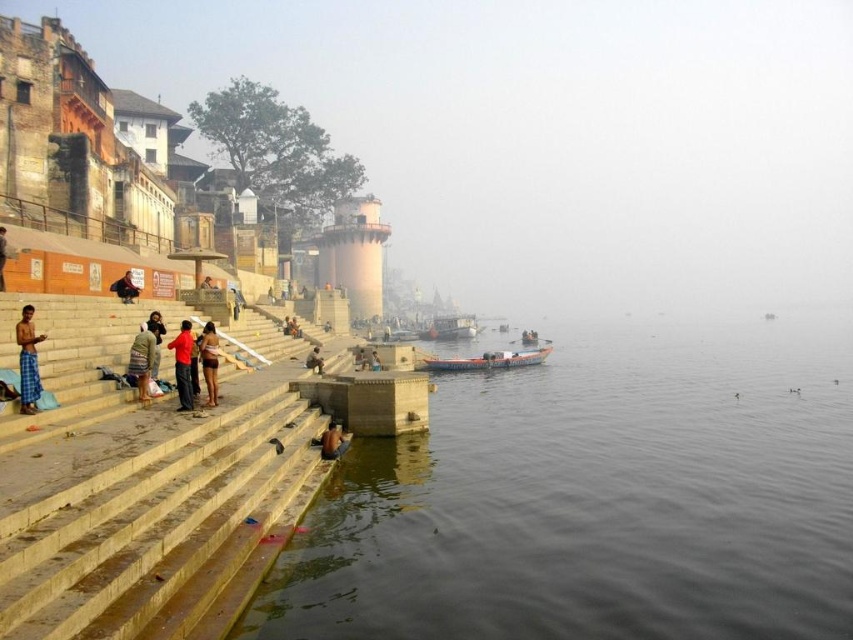
Which is in front, point (132, 292) or point (3, 262)?

Positioned in front is point (3, 262).

Is point (125, 284) less distant than point (3, 244)?

No, (125, 284) is further to viewer.

The image size is (853, 640). Find the location of `dark brown leather jacket at center`. dark brown leather jacket at center is located at coordinates (125, 289).

Find the location of `dark brown leather jacket at center`. dark brown leather jacket at center is located at coordinates (125, 289).

Is the position of dark gray water at lower center less distant than that of dark blue fabric at lower left?

Yes, dark gray water at lower center is in front of dark blue fabric at lower left.

Can you confirm if dark gray water at lower center is shorter than dark blue fabric at lower left?

No.

Does point (837, 326) come in front of point (4, 252)?

No, (837, 326) is further to viewer.

Where is `dark gray water at lower center`? The height and width of the screenshot is (640, 853). dark gray water at lower center is located at coordinates (596, 497).

This screenshot has height=640, width=853. Describe the element at coordinates (28, 360) in the screenshot. I see `blue plaid shorts at lower left` at that location.

Is blue plaid shorts at lower left smaller than red cotton shirt at center?

Yes, blue plaid shorts at lower left is smaller than red cotton shirt at center.

Does point (28, 406) come behind point (183, 378)?

No, it is in front of (183, 378).

The image size is (853, 640). In order to click on blue plaid shorts at lower left in this screenshot , I will do `click(28, 360)`.